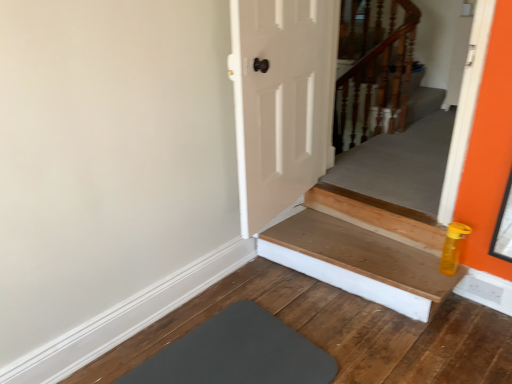
The height and width of the screenshot is (384, 512). What are the coordinates of `blank space above wooden at bottom (from a real-world perspective)` in the screenshot? It's located at (331, 248).